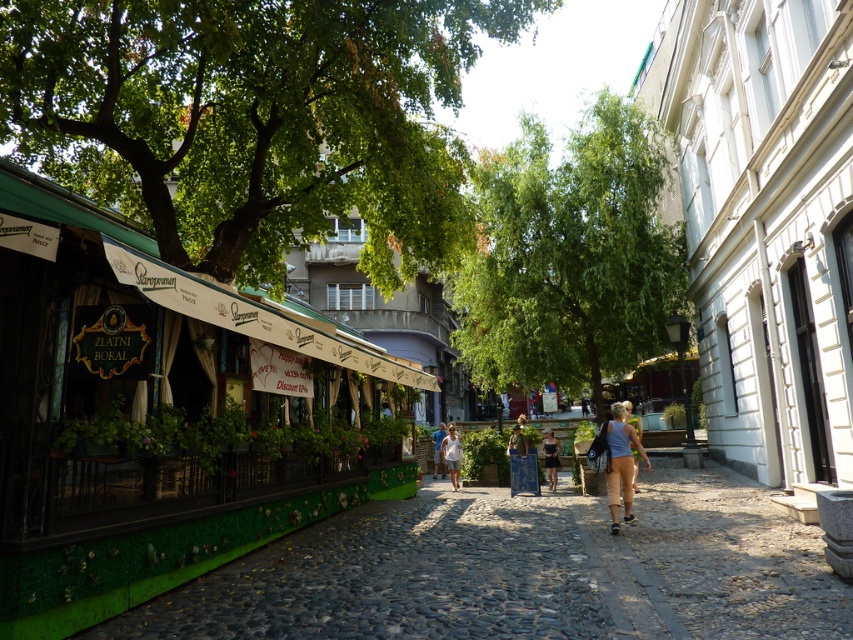
Between point (184, 385) and point (223, 234), which one is positioned in front?

Point (184, 385) is in front.

Consider the image. Does green textured awning at left have a lesser width compared to green leafy tree at left?

Yes.

Describe the element at coordinates (160, 413) in the screenshot. I see `green textured awning at left` at that location.

Find the location of a particular element. Image resolution: width=853 pixels, height=640 pixels. green textured awning at left is located at coordinates (160, 413).

Does green textured pavement at lower left have a lesser width compared to denim jacket at center?

No, green textured pavement at lower left is not thinner than denim jacket at center.

Is green textured pavement at lower left above denim jacket at center?

Correct, green textured pavement at lower left is located above denim jacket at center.

Where is `green textured pavement at lower left`? green textured pavement at lower left is located at coordinates click(524, 570).

Where is `green textured pavement at lower left`? This screenshot has width=853, height=640. green textured pavement at lower left is located at coordinates coord(524,570).

Is green textured awning at left below light blue fabric top at center?

No, green textured awning at left is not below light blue fabric top at center.

I want to click on green textured awning at left, so click(x=160, y=413).